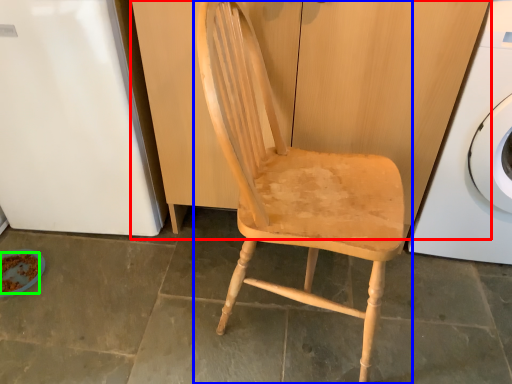
Question: Which object is the closest to the dresser (highlighted by a red box)? Choose among these: chair (highlighted by a blue box) or food (highlighted by a green box).

Choices:
 (A) chair
 (B) food

Answer: (A)